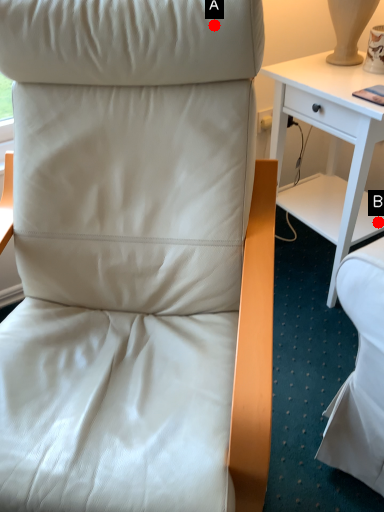
Question: Two points are circled on the image, labeled by A and B beside each circle. Which point is closer to the camera?

Choices:
 (A) A is closer
 (B) B is closer

Answer: (A)